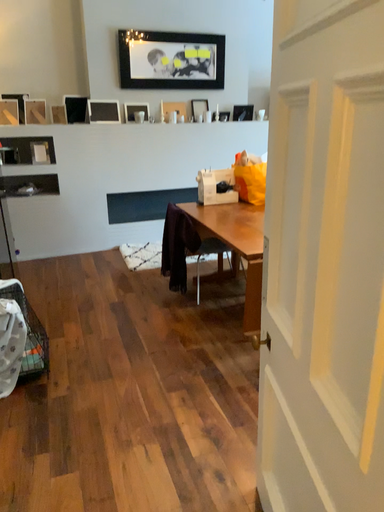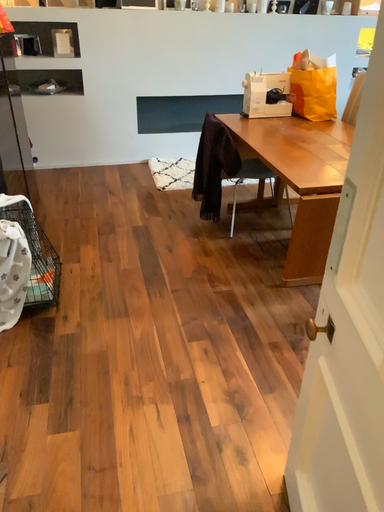
Question: Which way did the camera rotate in the video?

Choices:
 (A) rotated downward
 (B) rotated upward

Answer: (A)